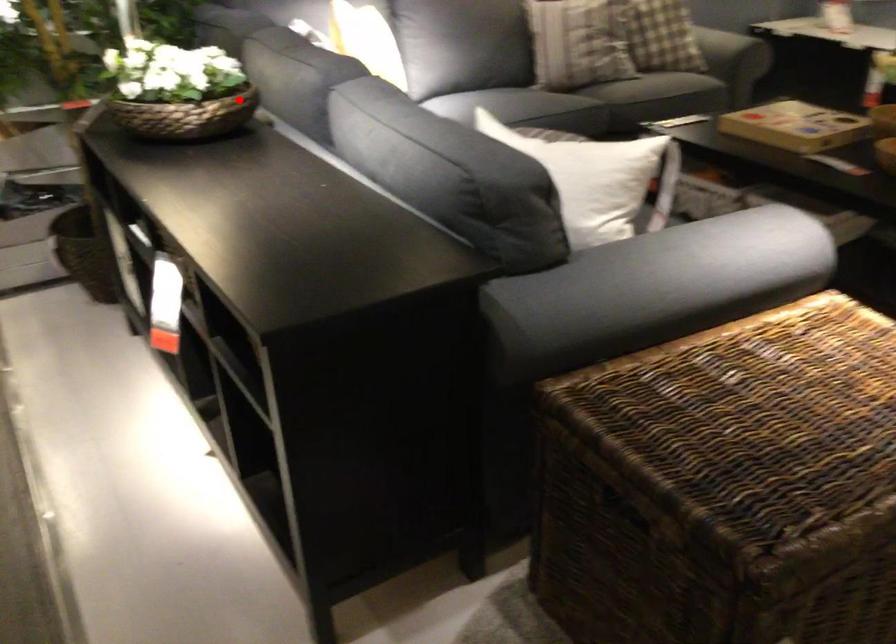
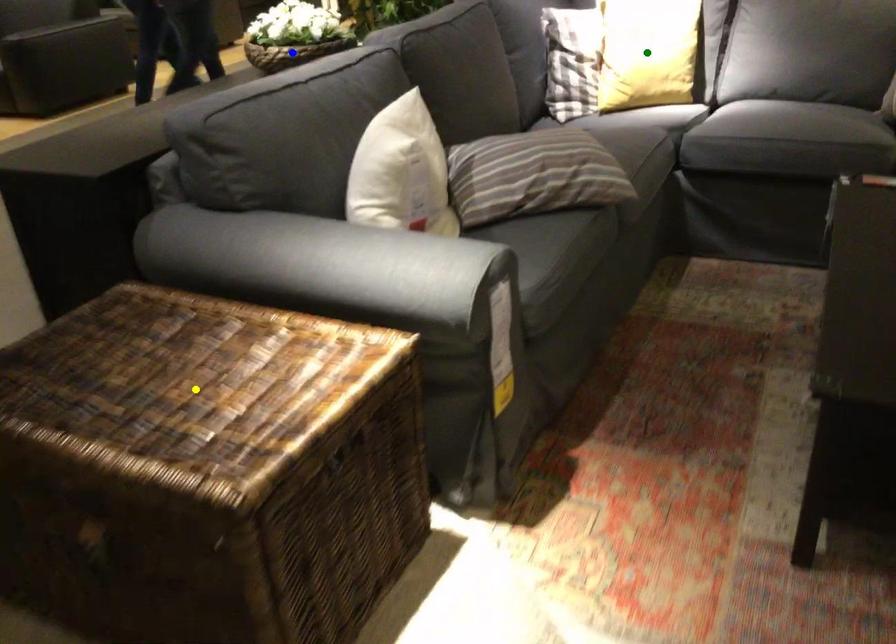
Question: I am providing you with two images of the same scene from different viewpoints. A red point is marked on the first image. You are given multiple points on the second image. Which point in image 2 represents the same 3d spot as the red point in image 1?

Choices:
 (A) blue point
 (B) yellow point
 (C) green point

Answer: (A)